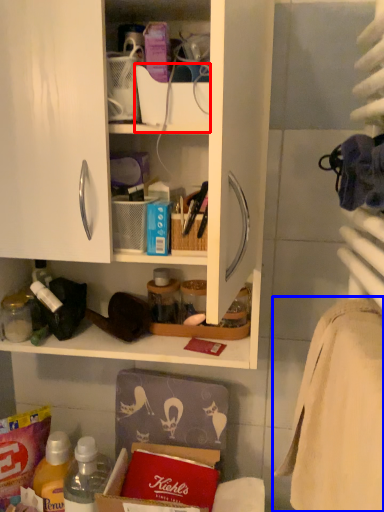
Question: Which object is further to the camera taking this photo, box (highlighted by a red box) or bath towel (highlighted by a blue box)?

Choices:
 (A) box
 (B) bath towel

Answer: (A)